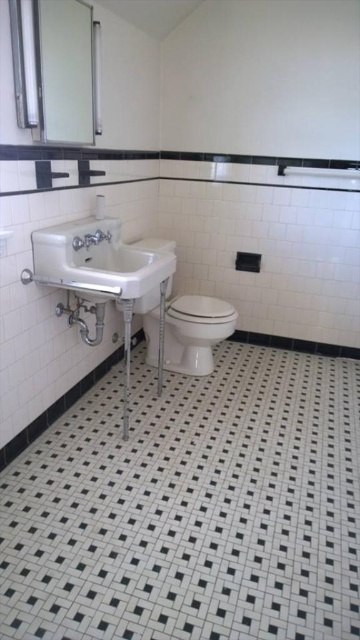
You are standing in the bathroom and want to place a small decorative item exactly at the center of the black mosaic tile at center. According to the bathroom layout, where should you place the item in terms of coordinates?

The black mosaic tile at center is located at coordinates point (191, 508), so you should place the decorative item at point (191, 508).

From the picture: You are designing a layout for a bathroom and need to place the white glossy toilet bowl at center and the matte white faucet at lower left. Given their sizes, which object will require more space in the bathroom layout?

The white glossy toilet bowl at center is larger in size than the matte white faucet at lower left, so it will require more space in the bathroom layout.